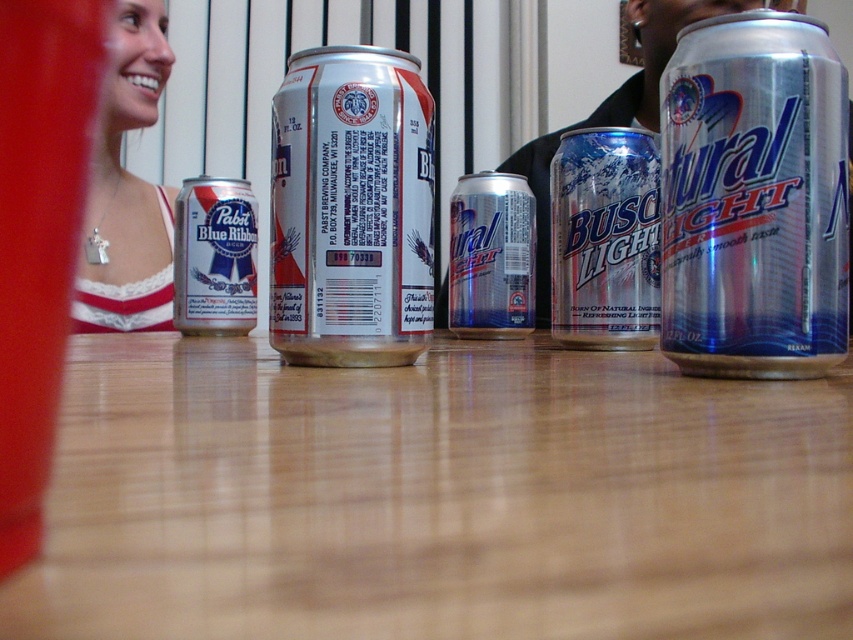
Question: Which of the following is the closest to the observer?

Choices:
 (A) (368, 189)
 (B) (627, 285)
 (C) (131, 38)

Answer: (A)

Question: Which point is closer to the camera taking this photo?

Choices:
 (A) (608, 138)
 (B) (364, 138)
 (C) (495, 330)
 (D) (158, 253)

Answer: (B)

Question: Is silver metallic busch light can at center above matte silver can at left?

Choices:
 (A) no
 (B) yes

Answer: (B)

Question: Which point is farther to the camera?

Choices:
 (A) silver metallic can at right
 (B) metallic silver can at center

Answer: (B)

Question: Can you confirm if silver metallic busch light can at center is positioned to the right of metallic silver can at center?

Choices:
 (A) yes
 (B) no

Answer: (A)

Question: Can you confirm if silver metallic can at right is positioned to the right of metallic silver can at center?

Choices:
 (A) yes
 (B) no

Answer: (A)